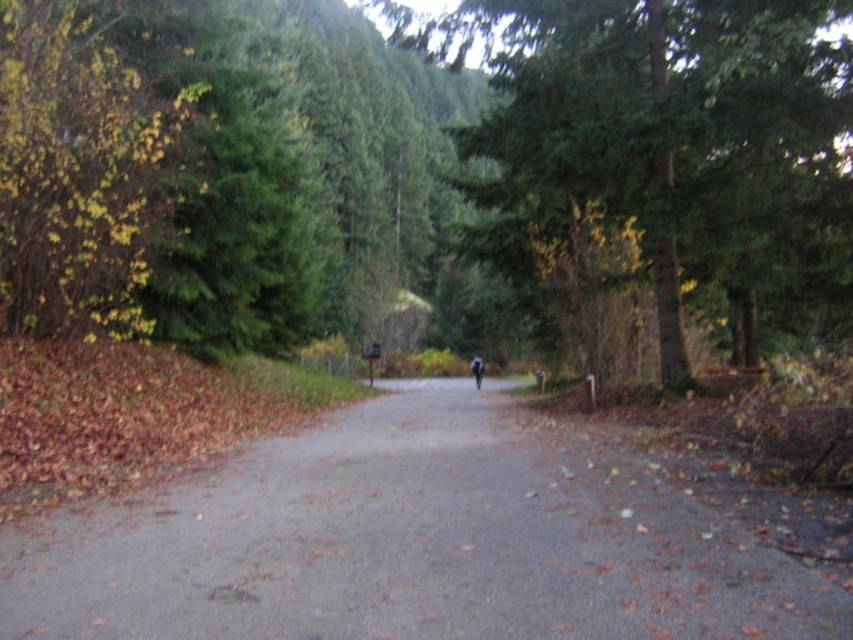
Question: Which is farther from the gray asphalt road at center?

Choices:
 (A) green matte tree at center
 (B) dark blue fabric at center

Answer: (B)

Question: Among these objects, which one is nearest to the camera?

Choices:
 (A) gray asphalt road at center
 (B) dark blue fabric at center

Answer: (A)

Question: Does gray asphalt road at center lie in front of green matte tree at center?

Choices:
 (A) yes
 (B) no

Answer: (A)

Question: Which point appears farthest from the camera in this image?

Choices:
 (A) (479, 362)
 (B) (734, 593)

Answer: (A)

Question: Observing the image, what is the correct spatial positioning of green matte tree at center in reference to dark blue fabric at center?

Choices:
 (A) below
 (B) above

Answer: (B)

Question: Is green matte tree at center wider than dark blue fabric at center?

Choices:
 (A) yes
 (B) no

Answer: (A)